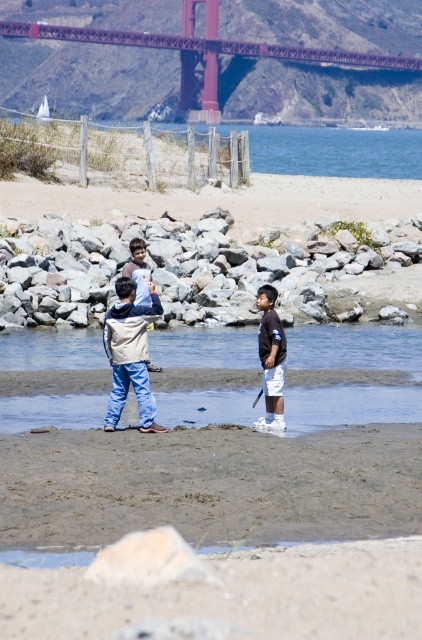
Is point (73, 104) closer to camera compared to point (378, 404)?

No.

Identify the location of rustic steel bridge at upper center. The width and height of the screenshot is (422, 640). (319, 58).

Is point (303, 92) positioned before point (294, 355)?

No, (303, 92) is behind (294, 355).

At what (x,y) coordinates should I click in order to perform the action: click on rustic steel bridge at upper center. Please return your answer as a coordinate pair (x, y). This screenshot has height=640, width=422. Looking at the image, I should click on (319, 58).

Is point (127, 560) positioned behind point (8, 346)?

No, it is not.

Consider the image. Who is lower down, light beige sand at lower center or white sand at lower center?

light beige sand at lower center

Is point (283, 625) in front of point (410, 410)?

Yes, point (283, 625) is in front of point (410, 410).

Locate an element on the screen. This screenshot has width=422, height=640. light beige sand at lower center is located at coordinates (221, 593).

Is rustic steel bridge at upper center smaller than smooth gray rock at center?

No.

Where is `rustic steel bridge at upper center`? The width and height of the screenshot is (422, 640). rustic steel bridge at upper center is located at coordinates (319, 58).

Locate an element on the screen. Image resolution: width=422 pixels, height=640 pixels. rustic steel bridge at upper center is located at coordinates (319, 58).